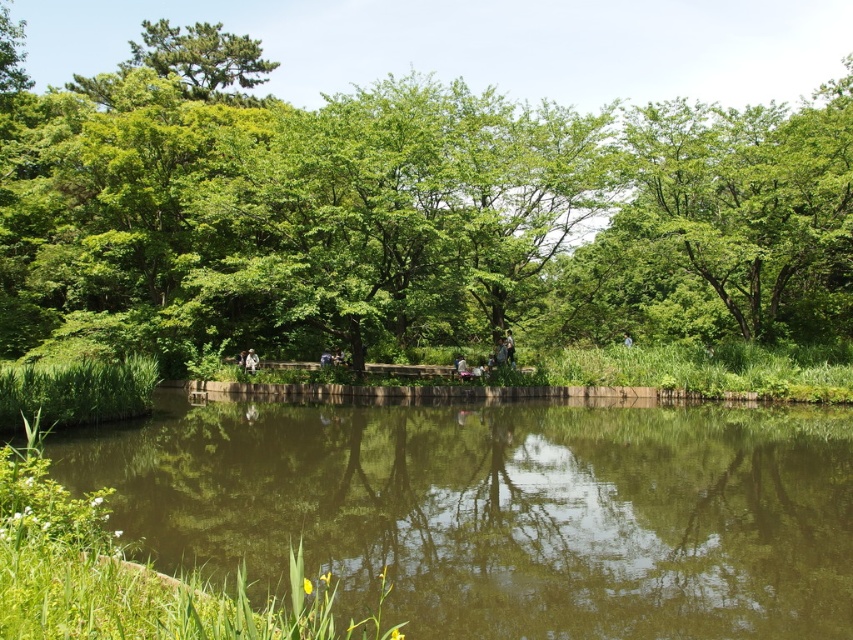
Question: Based on their relative distances, which object is farther from the green leafy tree at center?

Choices:
 (A) green reflective water at center
 (B) green leafy tree at upper left

Answer: (B)

Question: Can you confirm if green leafy tree at center is smaller than green leafy tree at upper left?

Choices:
 (A) yes
 (B) no

Answer: (B)

Question: Does green reflective water at center appear on the left side of green leafy tree at upper left?

Choices:
 (A) yes
 (B) no

Answer: (B)

Question: Is green leafy tree at center to the right of green reflective water at center from the viewer's perspective?

Choices:
 (A) no
 (B) yes

Answer: (A)

Question: Which point is closer to the camera?

Choices:
 (A) (415, 330)
 (B) (169, 36)
 (C) (468, 426)

Answer: (C)

Question: Among these points, which one is farthest from the camera?

Choices:
 (A) (598, 550)
 (B) (462, 93)

Answer: (B)